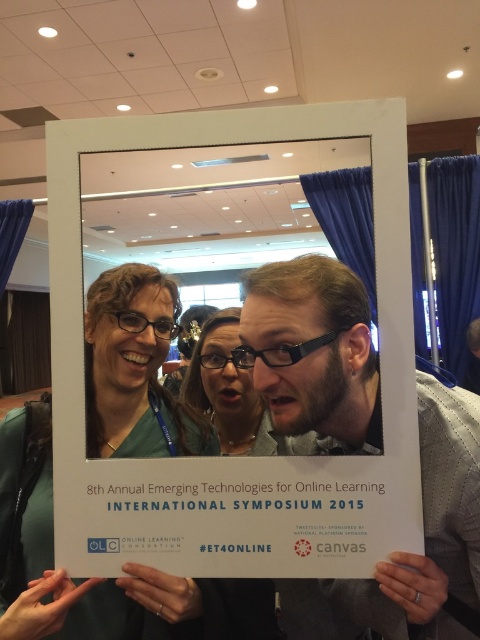
Question: Does white paper at center have a larger size compared to matte black glasses at center?

Choices:
 (A) yes
 (B) no

Answer: (A)

Question: Does white paper at center appear on the right side of matte black glasses at center?

Choices:
 (A) yes
 (B) no

Answer: (A)

Question: Which object appears closest to the camera in this image?

Choices:
 (A) white paper at center
 (B) matte black glasses at center

Answer: (B)

Question: Among these points, which one is nearest to the camera?

Choices:
 (A) (469, 486)
 (B) (349, 497)

Answer: (B)

Question: Is white paper at center closer to camera compared to matte black glasses at center?

Choices:
 (A) yes
 (B) no

Answer: (B)

Question: Which of the following is the farthest from the observer?

Choices:
 (A) (347, 120)
 (B) (477, 596)

Answer: (B)